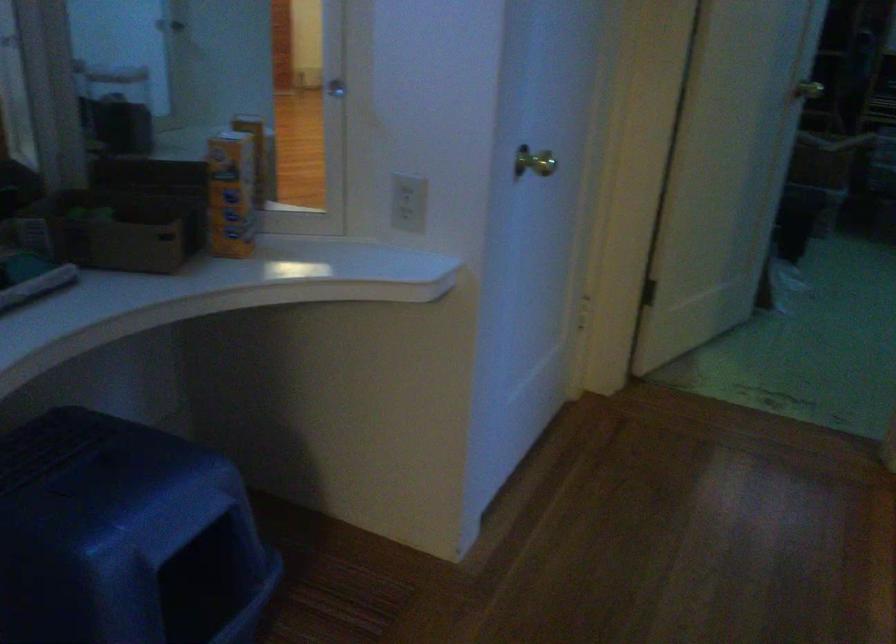
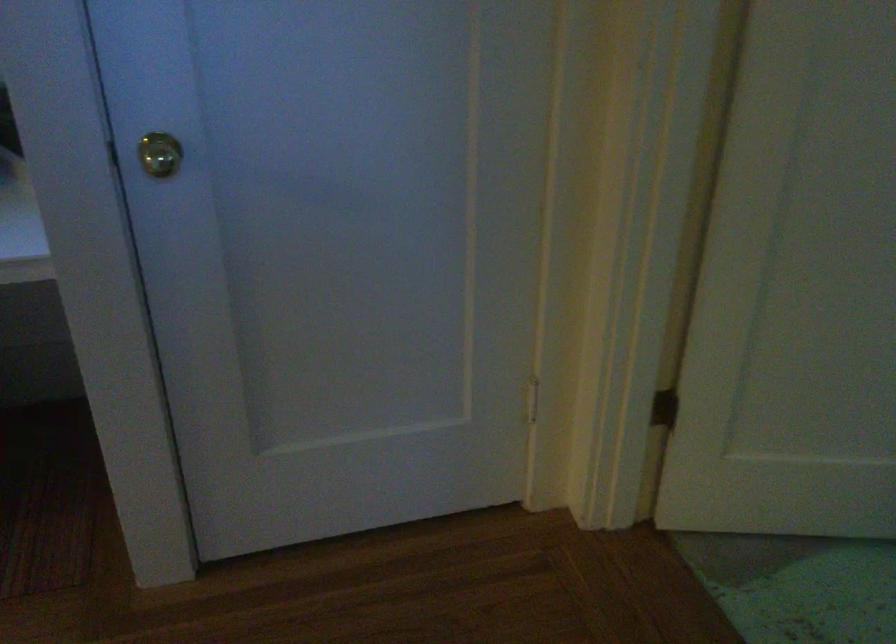
Locate, in the second image, the point that corresponds to (x=526, y=143) in the first image.

(159, 154)